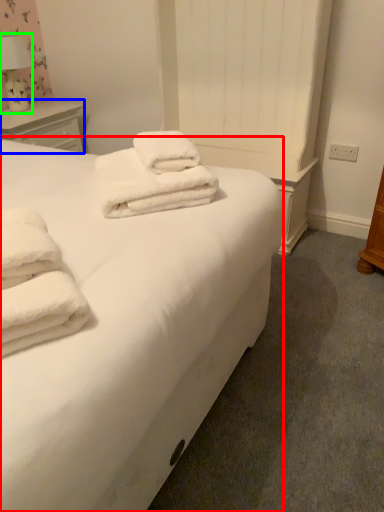
Question: Estimate the real-world distances between objects in this image. Which object is farther from bed (highlighted by a red box), nightstand (highlighted by a blue box) or table lamp (highlighted by a green box)?

Choices:
 (A) nightstand
 (B) table lamp

Answer: (B)